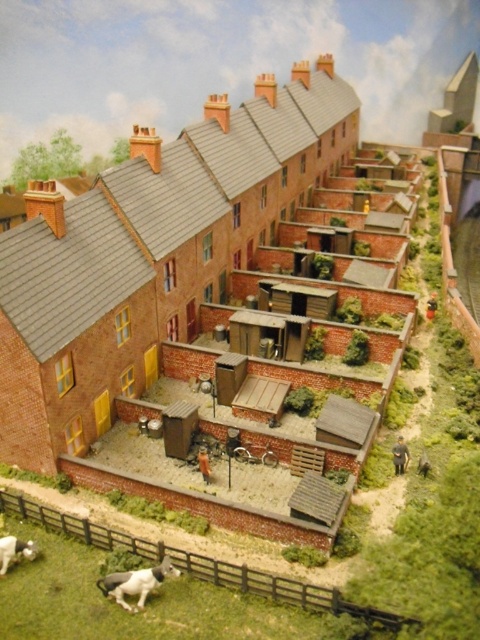
Question: Where is white glossy horse at lower left located in relation to white fur dog at lower left in the image?

Choices:
 (A) left
 (B) right

Answer: (B)

Question: Which point is closer to the camera taking this photo?

Choices:
 (A) (11, 557)
 (B) (159, 568)

Answer: (B)

Question: Is white glossy horse at lower left positioned behind white fur dog at lower left?

Choices:
 (A) no
 (B) yes

Answer: (A)

Question: Where is white glossy horse at lower left located in relation to white fur dog at lower left in the image?

Choices:
 (A) below
 (B) above

Answer: (A)